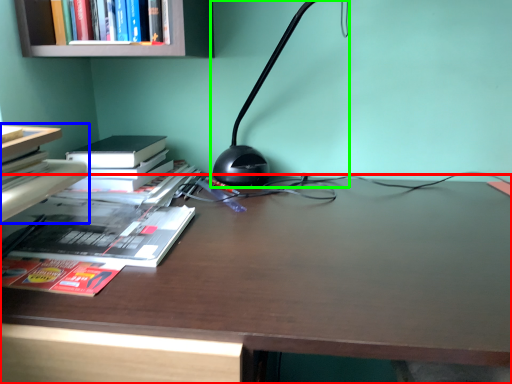
Question: Based on their relative distances, which object is nearer to desk (highlighted by a red box)? Choose from book (highlighted by a blue box) and lamp (highlighted by a green box).

Choices:
 (A) book
 (B) lamp

Answer: (B)